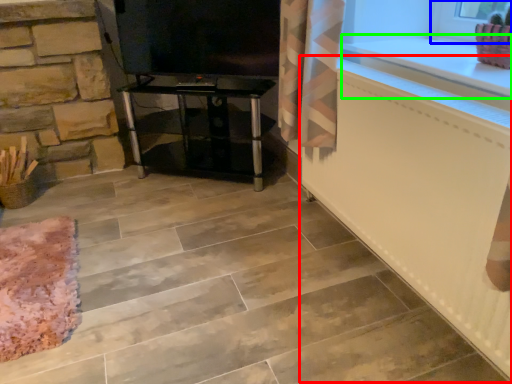
Question: Which object is the closest to the radiator (highlighted by a red box)? Choose among these: window frame (highlighted by a blue box) or counter top (highlighted by a green box).

Choices:
 (A) window frame
 (B) counter top

Answer: (B)